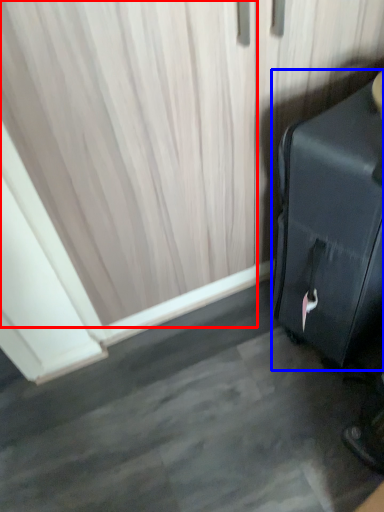
Question: Which object appears farthest to the camera in this image, curtain (highlighted by a red box) or suitcase (highlighted by a blue box)?

Choices:
 (A) curtain
 (B) suitcase

Answer: (A)